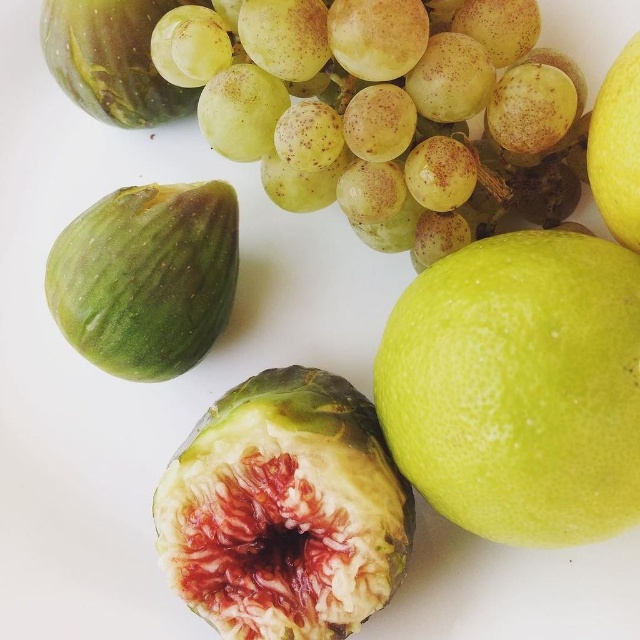
Question: Observing the image, what is the correct spatial positioning of green matte grape at upper center in reference to yellow matte lemon at upper right?

Choices:
 (A) left
 (B) right

Answer: (A)

Question: Does ripe red fig at center appear on the left side of green matte fig at left?

Choices:
 (A) yes
 (B) no

Answer: (B)

Question: Can you confirm if green matte grape at upper center is positioned below green matte fig at left?

Choices:
 (A) no
 (B) yes

Answer: (A)

Question: Which point is closer to the camera taking this photo?

Choices:
 (A) (388, 560)
 (B) (112, 195)
 (C) (493, 266)
 (D) (609, 177)

Answer: (D)

Question: Which point appears farthest from the camera in this image?

Choices:
 (A) (412, 429)
 (B) (378, 161)

Answer: (B)

Question: Which object appears farthest from the camera in this image?

Choices:
 (A) green matte grape at upper center
 (B) yellow matte lemon at upper right

Answer: (A)